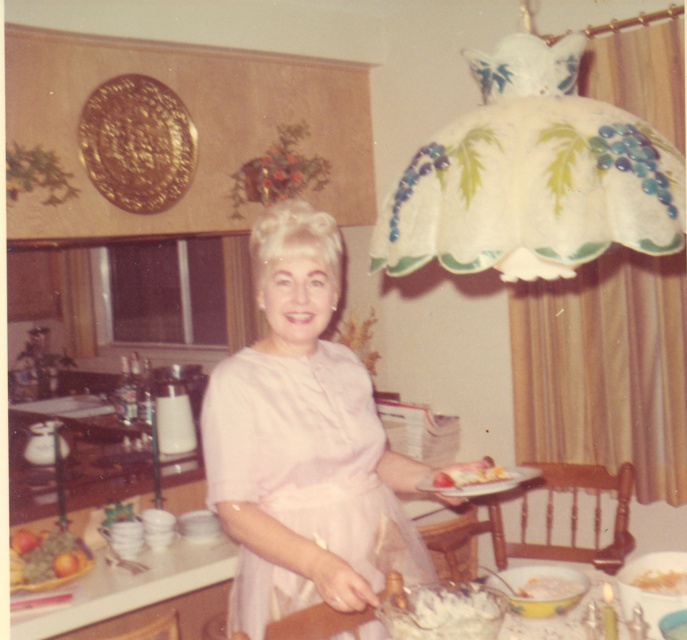
Can you confirm if white fluffy cake at lower center is smaller than shiny metallic fruit bowl at lower left?

Indeed, white fluffy cake at lower center has a smaller size compared to shiny metallic fruit bowl at lower left.

The image size is (687, 640). What are the coordinates of `white fluffy cake at lower center` in the screenshot? It's located at pos(442,612).

At what (x,y) coordinates should I click in order to perform the action: click on white fluffy cake at lower center. Please return your answer as a coordinate pair (x, y). Looking at the image, I should click on (442, 612).

Looking at this image, is white porcelain plate at lower right thinner than white fluffy bread at lower right?

No.

Which is below, white porcelain plate at lower right or white fluffy bread at lower right?

white fluffy bread at lower right

Between point (444, 486) and point (664, 579), which one is positioned behind?

Positioned behind is point (664, 579).

I want to click on white porcelain plate at lower right, so click(x=480, y=481).

Which is below, white fluffy cake at lower center or white creamy dessert at lower center?

Positioned lower is white creamy dessert at lower center.

What are the coordinates of `white fluffy cake at lower center` in the screenshot? It's located at (442, 612).

Is point (427, 616) behind point (567, 580)?

No.

Identify the location of white fluffy cake at lower center. This screenshot has width=687, height=640. (442, 612).